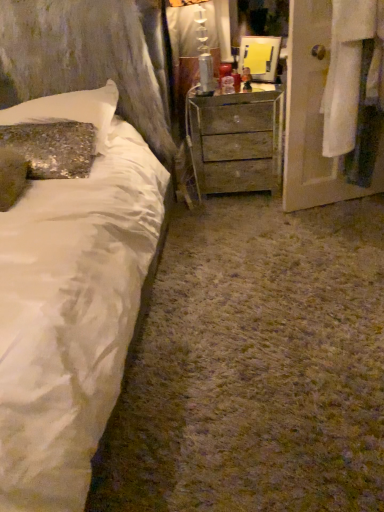
Question: Is white fabric door at right thinner than white satin bed at left?

Choices:
 (A) no
 (B) yes

Answer: (B)

Question: Can you confirm if white fabric door at right is bigger than white satin bed at left?

Choices:
 (A) yes
 (B) no

Answer: (B)

Question: Is white fabric door at right next to white satin bed at left and touching it?

Choices:
 (A) yes
 (B) no

Answer: (B)

Question: From a real-world perspective, is white fabric door at right on white satin bed at left?

Choices:
 (A) no
 (B) yes

Answer: (A)

Question: From the image's perspective, does white fabric door at right appear lower than white satin bed at left?

Choices:
 (A) yes
 (B) no

Answer: (B)

Question: Visually, is sparkly sequin pillow at upper left positioned to the left or to the right of white satin bed at left?

Choices:
 (A) right
 (B) left

Answer: (A)

Question: Is point (99, 151) positioned closer to the camera than point (56, 297)?

Choices:
 (A) farther
 (B) closer

Answer: (A)

Question: In the image, is sparkly sequin pillow at upper left positioned in front of or behind white satin bed at left?

Choices:
 (A) front
 (B) behind

Answer: (B)

Question: From the image's perspective, is sparkly sequin pillow at upper left located above or below white satin bed at left?

Choices:
 (A) below
 (B) above

Answer: (B)

Question: From a real-world perspective, relative to wooden chest of drawers at center, is white fabric door at right vertically above or below?

Choices:
 (A) below
 (B) above

Answer: (B)

Question: From the image's perspective, is white fabric door at right located above or below wooden chest of drawers at center?

Choices:
 (A) below
 (B) above

Answer: (B)

Question: Do you think white fabric door at right is within wooden chest of drawers at center, or outside of it?

Choices:
 (A) inside
 (B) outside

Answer: (B)

Question: In terms of size, does white fabric door at right appear bigger or smaller than wooden chest of drawers at center?

Choices:
 (A) big
 (B) small

Answer: (B)

Question: Would you say white satin bed at left is inside or outside sparkly sequin pillow at upper left?

Choices:
 (A) inside
 (B) outside

Answer: (B)

Question: From their relative heights in the image, would you say white satin bed at left is taller or shorter than sparkly sequin pillow at upper left?

Choices:
 (A) short
 (B) tall

Answer: (B)